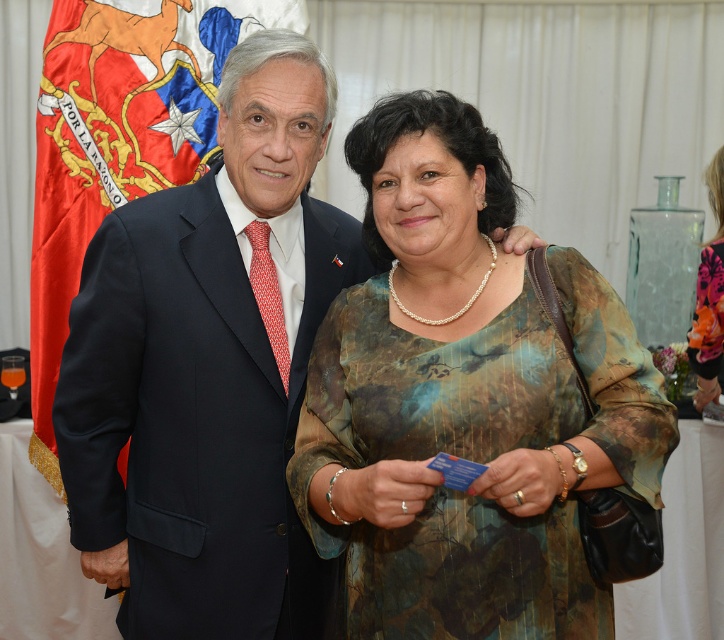
Question: Which object is closer to the camera taking this photo?

Choices:
 (A) red silk flag at left
 (B) textured green dress at center
 (C) dark blue suit at center

Answer: (B)

Question: Does textured green dress at center come in front of floral silk dress at center?

Choices:
 (A) no
 (B) yes

Answer: (B)

Question: Which point appears closest to the camera in this image?

Choices:
 (A) (689, 352)
 (B) (550, 579)

Answer: (B)

Question: Which is farther from the floral silk dress at center?

Choices:
 (A) dark blue suit at center
 (B) red silk flag at left

Answer: (B)

Question: Is textured green dress at center to the left of dark blue suit at center from the viewer's perspective?

Choices:
 (A) no
 (B) yes

Answer: (A)

Question: Is textured green dress at center wider than dark blue suit at center?

Choices:
 (A) no
 (B) yes

Answer: (B)